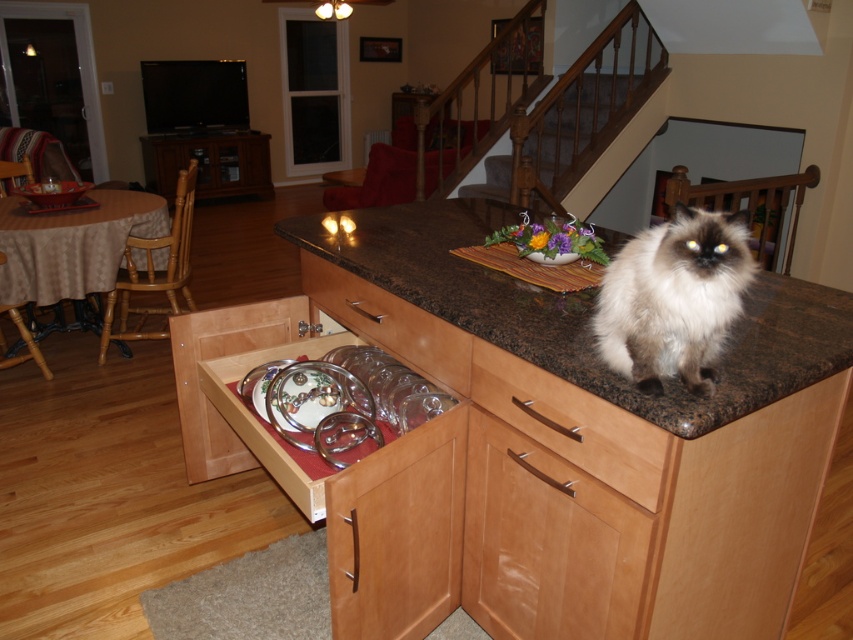
Question: Which point appears closest to the camera in this image?

Choices:
 (A) (360, 266)
 (B) (602, 348)
 (C) (630, 492)

Answer: (C)

Question: Estimate the real-world distances between objects in this image. Which object is farther from the wooden drawer at center?

Choices:
 (A) clear glass plates at center
 (B) granite countertop at center

Answer: (A)

Question: Is granite countertop at center below white fluffy cat at center?

Choices:
 (A) yes
 (B) no

Answer: (B)

Question: Is granite countertop at center to the right of white fluffy cat at center from the viewer's perspective?

Choices:
 (A) yes
 (B) no

Answer: (B)

Question: Which object appears closest to the camera in this image?

Choices:
 (A) wooden drawer at center
 (B) granite countertop at center

Answer: (B)

Question: Can you confirm if white fluffy cat at center is thinner than wooden drawer at center?

Choices:
 (A) no
 (B) yes

Answer: (A)